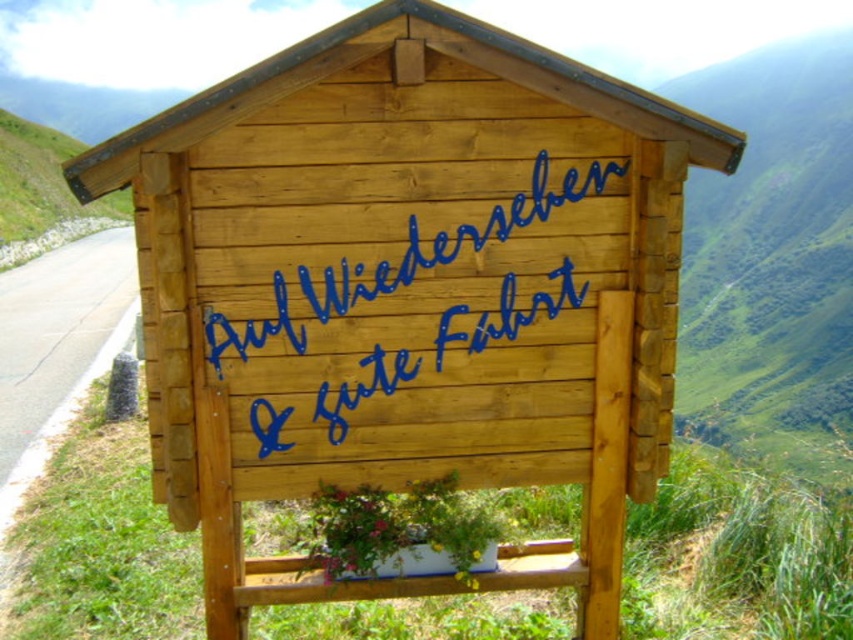
You are a hiker who wants to take a photo of the signboard. You need to stand on either the green grassy hillside at upper right or the asphalt road at left. Which location would allow you to see the entire signboard without any obstruction?

The green grassy hillside at upper right is taller than asphalt road at left, so standing on the green grassy hillside at upper right would provide a higher vantage point, allowing you to see the entire signboard without obstruction.

You are a hiker who just finished a long trek and is now standing at the base of the mountain. You see the green grassy hillside at upper right and the blue painted wood sign at center. Which object is bigger in the image?

The green grassy hillside at upper right is larger in size than the blue painted wood sign at center.